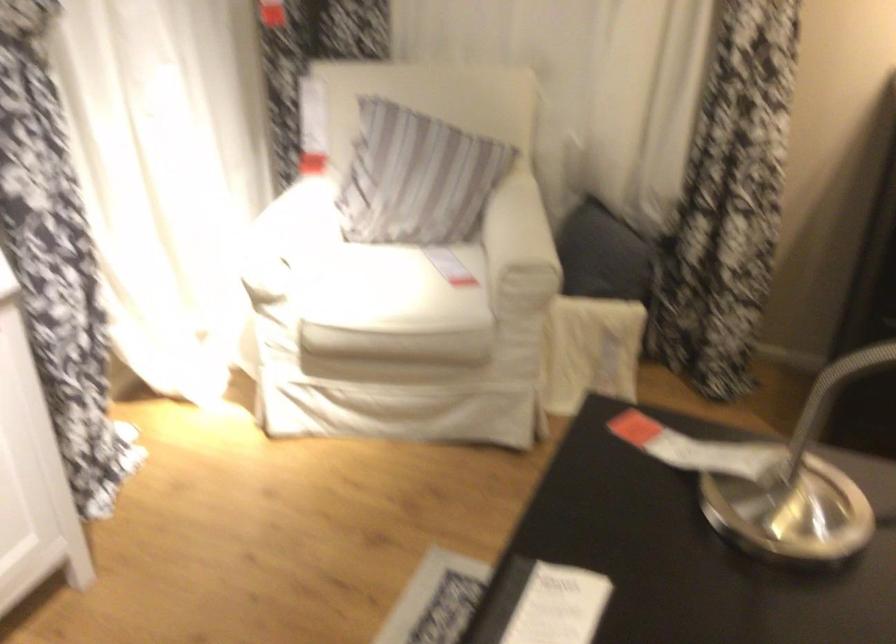
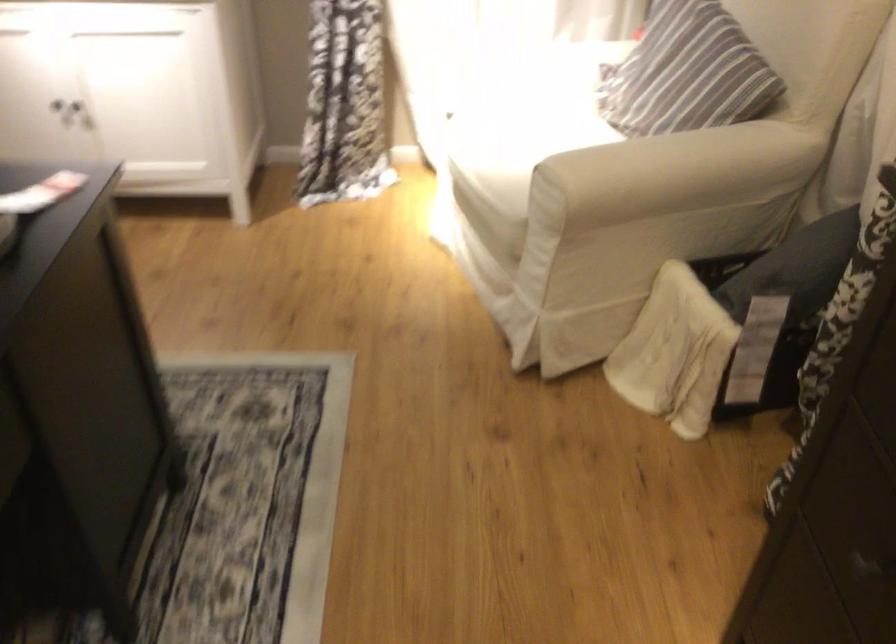
Locate, in the second image, the point that corresponds to point 549,225 in the first image.

(669, 169)